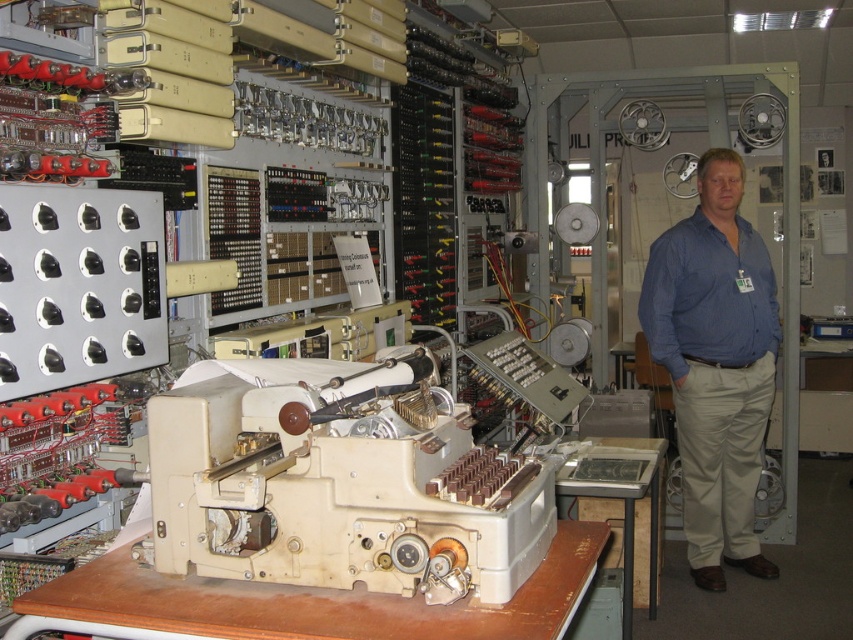
Question: Which of the following is the farthest from the observer?

Choices:
 (A) beige wood workbench at center
 (B) blue cotton shirt at right
 (C) beige plastic typewriter at center
 (D) blue shirt at center

Answer: (D)

Question: Can you confirm if blue shirt at center is positioned to the right of beige wood workbench at center?

Choices:
 (A) yes
 (B) no

Answer: (A)

Question: Estimate the real-world distances between objects in this image. Which object is closer to the blue cotton shirt at right?

Choices:
 (A) blue shirt at center
 (B) beige wood workbench at center

Answer: (A)

Question: Can you confirm if beige wood workbench at center is smaller than blue cotton shirt at right?

Choices:
 (A) no
 (B) yes

Answer: (B)

Question: Which of the following is the farthest from the observer?

Choices:
 (A) blue cotton shirt at right
 (B) beige wood workbench at center
 (C) beige plastic typewriter at center
 (D) blue shirt at center

Answer: (D)

Question: Does beige plastic typewriter at center appear over blue cotton shirt at right?

Choices:
 (A) no
 (B) yes

Answer: (A)